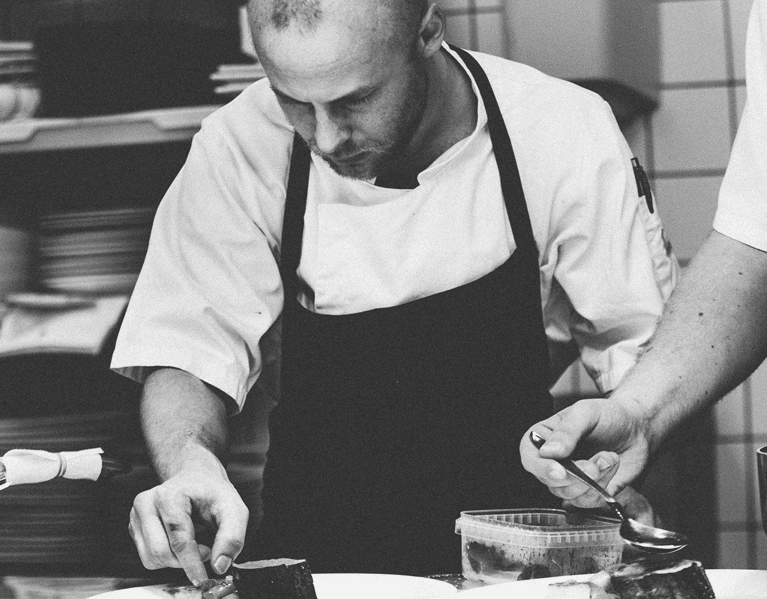
I want to click on clear container, so click(509, 546).